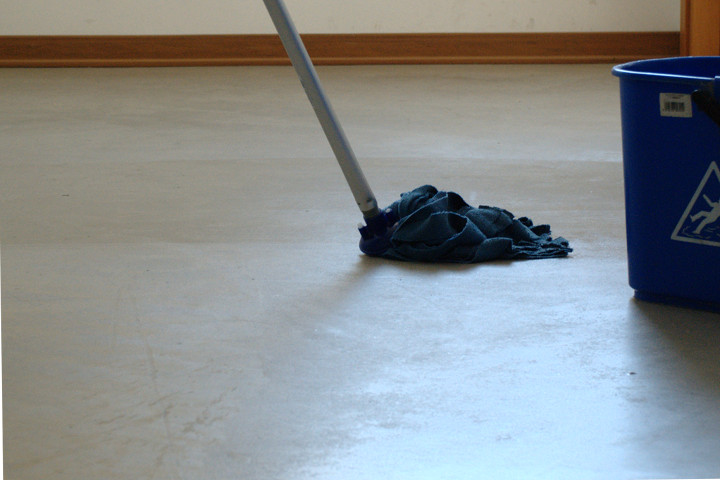
At what (x,y) coordinates should I click in order to perform the action: click on blue mop. Please return your answer as a coordinate pair (x, y). The width and height of the screenshot is (720, 480). Looking at the image, I should click on (451, 206).